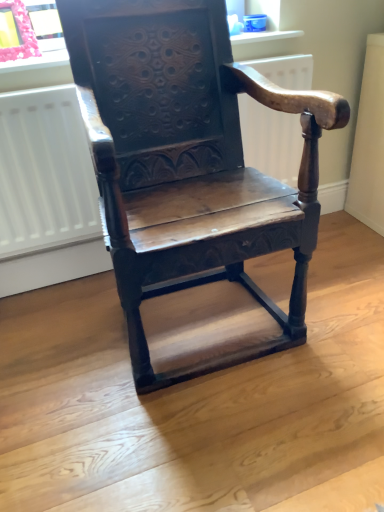
This screenshot has height=512, width=384. In order to click on vacant region to the left of wooden carved chair at center in this screenshot , I will do click(62, 351).